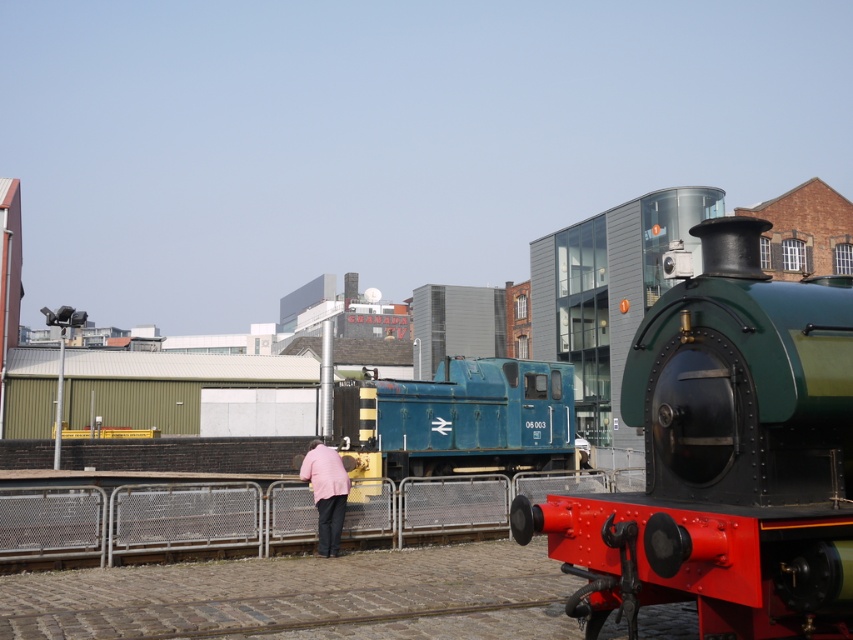
Is green polished metal train at center positioned in front of metallic fence at center?

Yes.

Is green polished metal train at center bigger than metallic fence at center?

Yes, green polished metal train at center is bigger than metallic fence at center.

Where is `green polished metal train at center`? green polished metal train at center is located at coordinates (726, 456).

Between green polished metal train at center and blue painted metal train at center, which one has less height?

blue painted metal train at center

Between green polished metal train at center and blue painted metal train at center, which one has more height?

Standing taller between the two is green polished metal train at center.

What do you see at coordinates (726, 456) in the screenshot? Image resolution: width=853 pixels, height=640 pixels. I see `green polished metal train at center` at bounding box center [726, 456].

Where is `green polished metal train at center`? green polished metal train at center is located at coordinates (726, 456).

Who is positioned more to the left, green polished metal train at center or pink fabric jacket at center?

Positioned to the left is pink fabric jacket at center.

Who is shorter, green polished metal train at center or pink fabric jacket at center?

Standing shorter between the two is pink fabric jacket at center.

Between point (732, 253) and point (308, 449), which one is positioned in front?

Positioned in front is point (732, 253).

Find the location of `green polished metal train at center`. green polished metal train at center is located at coordinates (726, 456).